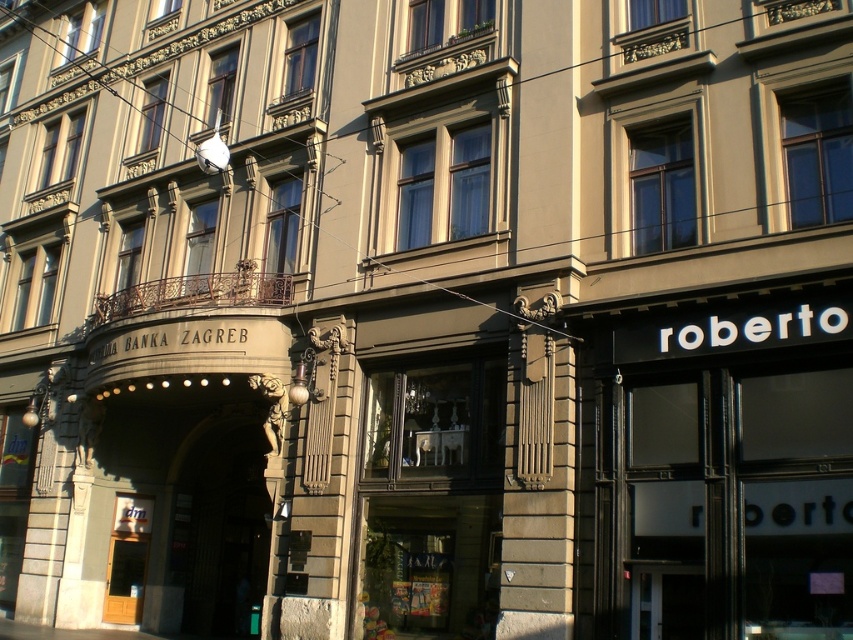
Based on the photo, you are standing in front of the building and want to enter the bank. The bank entrance is labeled with the name BANKA ZAGREB. There is a point at coordinates (x=718, y=468) on the black glass door at right. Can you use this point to locate the bank entrance?

The point at (x=718, y=468) is on the black glass door at right, so the black glass door at right is not the bank entrance labeled BANKA ZAGREB which is on the left side. Therefore, you should look for the entrance on the left side instead.